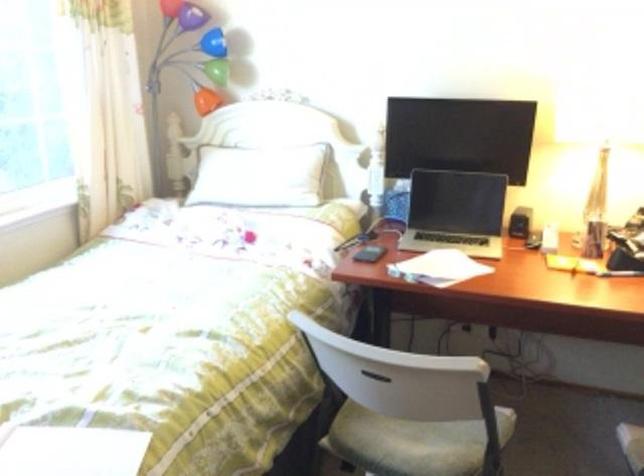
Identify the location of purple lamp head. (191, 17).